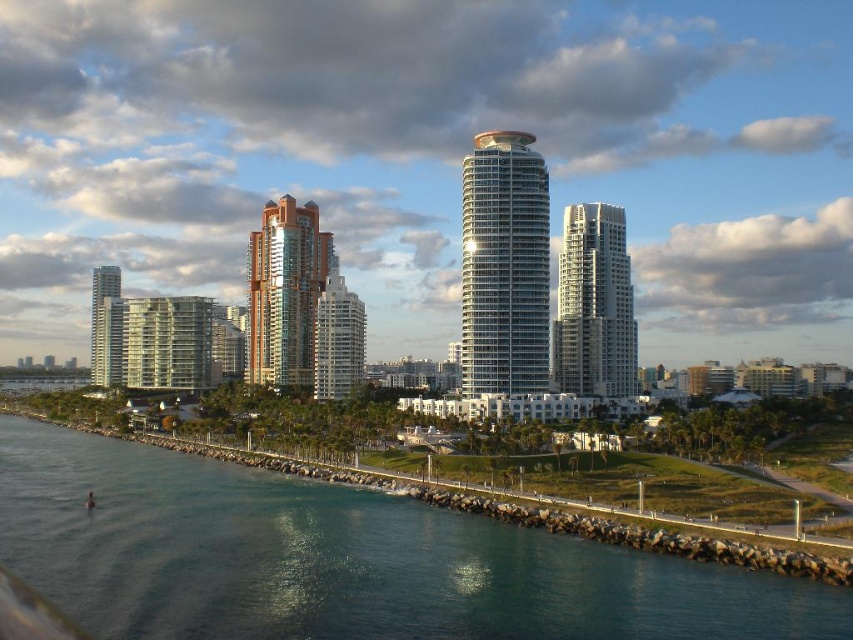
You are standing at the edge of the waterfront and want to determine which of the two points, point (x=310, y=280) or point (x=315, y=305), is closer to you. Based on the scene, which point is nearer?

Point (x=310, y=280) is closer to you because it is further to the viewer than point (x=315, y=305).

You are standing at the edge of the waterfront and want to take a photo of the clear blue water at lower left and the glassy reflective building at center. Which object should you focus on first to ensure both are in sharp focus?

You should focus on the clear blue water at lower left first because it is closer to the viewer than the glassy reflective building at center, so focusing on the closer object will help ensure both are in focus.